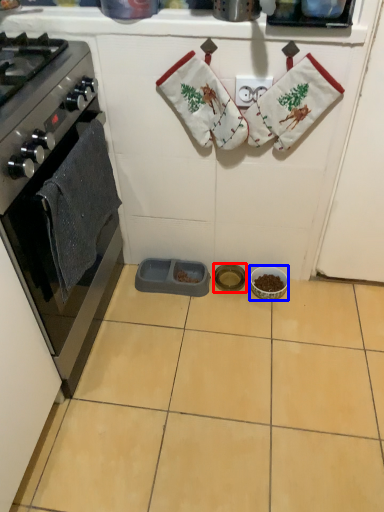
Question: Which point is closer to the camera, appliance (highlighted by a red box) or appliance (highlighted by a blue box)?

Choices:
 (A) appliance
 (B) appliance

Answer: (B)